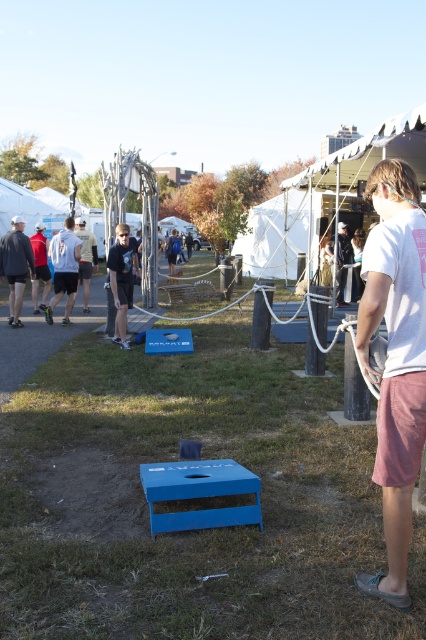
Question: Which of the following is the closest to the observer?

Choices:
 (A) (362, 228)
 (B) (40, 278)
 (C) (94, 264)

Answer: (B)

Question: Can you confirm if green grass at center is positioned below matte black jacket at center?

Choices:
 (A) yes
 (B) no

Answer: (A)

Question: Which point is farther to the camera?

Choices:
 (A) light blue t-shirt at center
 (B) matte black jacket at center
 (C) white t-shirt at left
 (D) black leather jacket at center

Answer: (B)

Question: Which object appears closest to the camera in this image?

Choices:
 (A) black leather jacket at center
 (B) white t-shirt at left

Answer: (B)

Question: Is white t-shirt at left to the left of light blue t-shirt at center from the viewer's perspective?

Choices:
 (A) no
 (B) yes

Answer: (A)

Question: Is green grass at center thinner than light blue t-shirt at center?

Choices:
 (A) no
 (B) yes

Answer: (B)